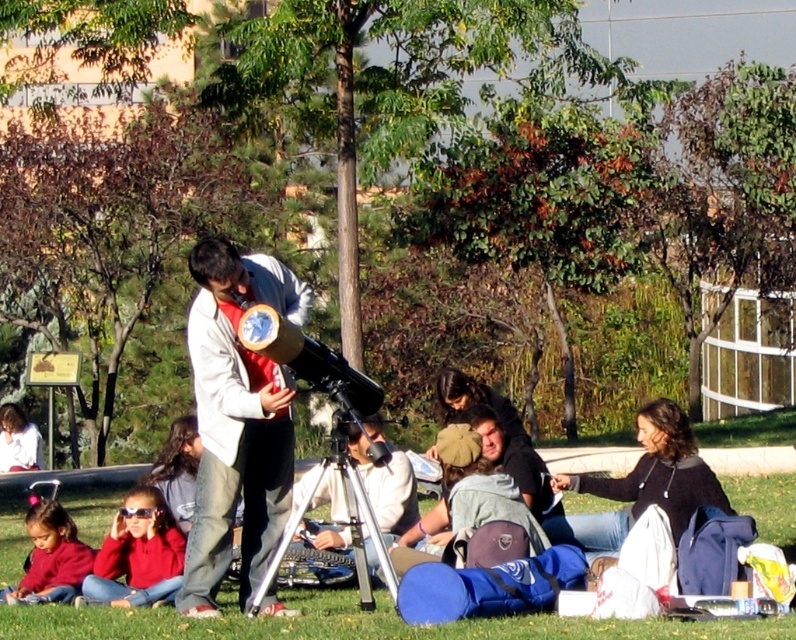
Consider the image. You are a photographer trying to capture a clear shot of the matte white jacket at center and the matte red sweater at lower left. Since you want both subjects to be visible in the frame, which one should you focus on first to ensure depth of field?

The matte white jacket at center should be focused on first because it is taller than the matte red sweater at lower left, ensuring both are in focus when using depth of field techniques.

You are taking a photo of the scene and want to focus on both the point at coordinates point (268, 534) and point (41, 508). Which point should you focus on first to ensure both are in focus?

You should focus on point (268, 534) first because it is closer to the camera than point (41, 508), ensuring depth of field captures both points.